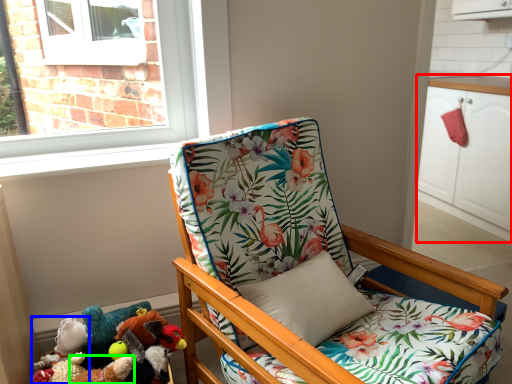
Question: Based on their relative distances, which object is farther from cabinetry (highlighted by a red box)? Choose from toy (highlighted by a blue box) and toy (highlighted by a green box).

Choices:
 (A) toy
 (B) toy

Answer: (A)